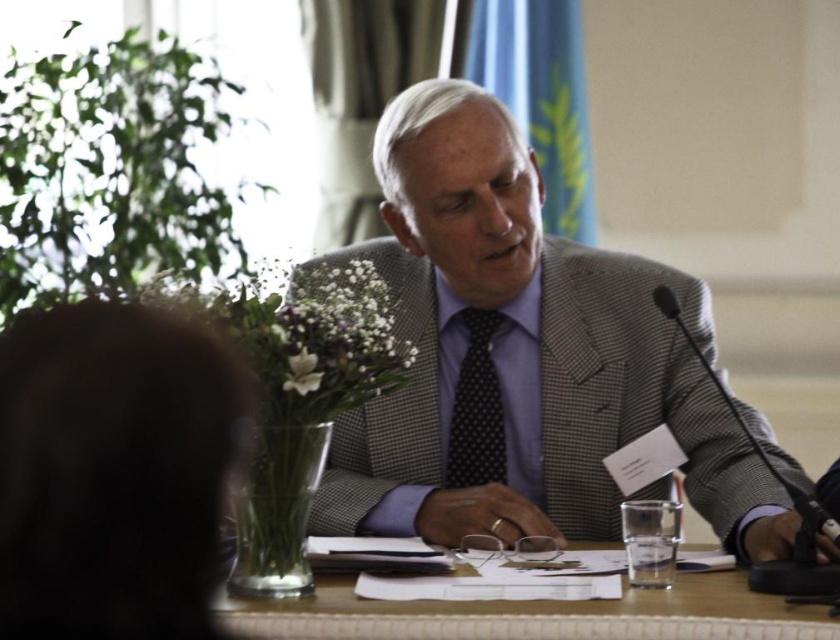
Consider the image. Can you confirm if gray textured suit at center is taller than polka dot silk tie at center?

Correct, gray textured suit at center is much taller as polka dot silk tie at center.

Does gray textured suit at center have a larger size compared to polka dot silk tie at center?

Yes.

Who is more distant from viewer, (x=547, y=244) or (x=474, y=346)?

Positioned behind is point (x=547, y=244).

Locate an element on the screen. The image size is (840, 640). gray textured suit at center is located at coordinates (525, 355).

Based on the photo, between gray textured suit at center and wooden table at center, which one appears on the right side from the viewer's perspective?

From the viewer's perspective, wooden table at center appears more on the right side.

Can you confirm if gray textured suit at center is positioned above wooden table at center?

Yes, gray textured suit at center is above wooden table at center.

At what (x,y) coordinates should I click in order to perform the action: click on gray textured suit at center. Please return your answer as a coordinate pair (x, y). This screenshot has width=840, height=640. Looking at the image, I should click on (525, 355).

Between point (717, 625) and point (445, 449), which one is positioned behind?

Point (445, 449)

Is wooden table at center behind polka dot silk tie at center?

No.

Where is `wooden table at center`? This screenshot has width=840, height=640. wooden table at center is located at coordinates (534, 614).